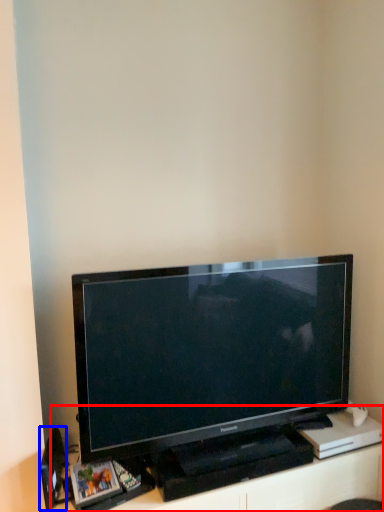
Question: Which point is further to the camera, entertainment center (highlighted by a red box) or speaker (highlighted by a blue box)?

Choices:
 (A) entertainment center
 (B) speaker

Answer: (B)